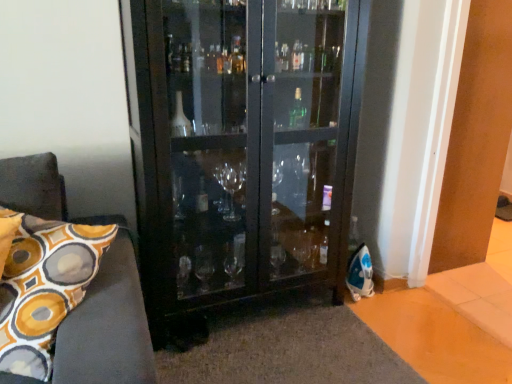
At what (x,y) coordinates should I click in order to perform the action: click on patterned fabric pillow at left. Please return your answer as a coordinate pair (x, y). Looking at the image, I should click on (108, 327).

What do you see at coordinates (108, 327) in the screenshot?
I see `patterned fabric pillow at left` at bounding box center [108, 327].

Where is `patterned fabric pillow at left`? patterned fabric pillow at left is located at coordinates [x=108, y=327].